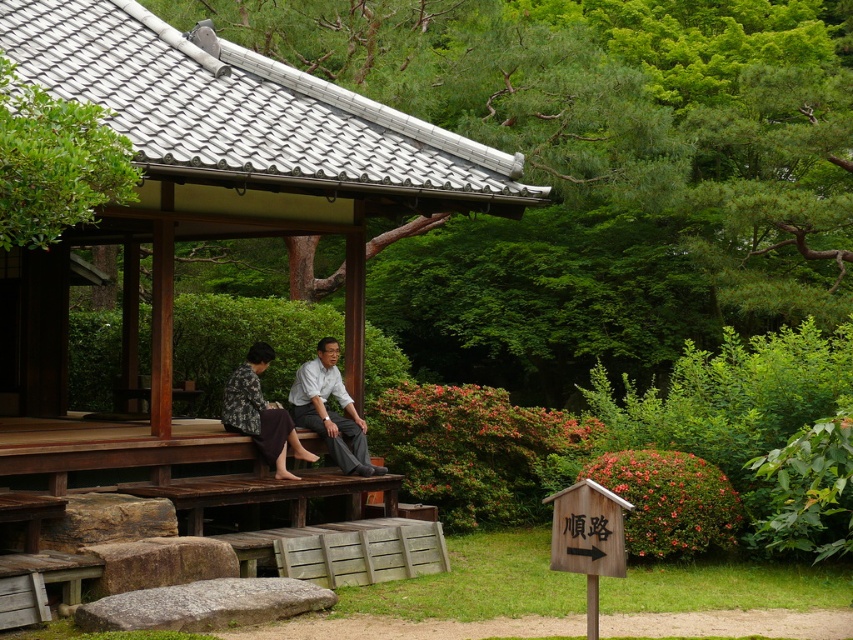
Question: Does wooden gazebo at center appear on the right side of green leafy tree at upper left?

Choices:
 (A) yes
 (B) no

Answer: (A)

Question: Which object is the closest to the matte gray pants at center?

Choices:
 (A) green leafy tree at upper left
 (B) wooden gazebo at center

Answer: (B)

Question: Which object appears closest to the camera in this image?

Choices:
 (A) wooden gazebo at center
 (B) matte gray pants at center
 (C) green leafy tree at upper left

Answer: (C)

Question: Which object is farther from the camera taking this photo?

Choices:
 (A) matte gray pants at center
 (B) green leafy tree at upper left

Answer: (A)

Question: Is the position of green leafy tree at upper left more distant than that of matte gray pants at center?

Choices:
 (A) no
 (B) yes

Answer: (A)

Question: Does wooden gazebo at center appear under matte gray pants at center?

Choices:
 (A) no
 (B) yes

Answer: (A)